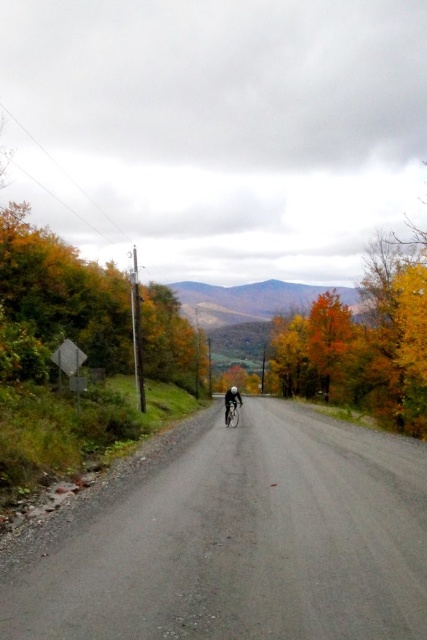
Is gray gravel road at center below shiny metallic bicycle at center?

No, gray gravel road at center is not below shiny metallic bicycle at center.

Who is more distant from viewer, (190, 460) or (236, 410)?

Positioned behind is point (236, 410).

Does point (351, 579) come closer to viewer compared to point (231, 420)?

Yes, it is.

Locate an element on the screen. This screenshot has width=427, height=640. gray gravel road at center is located at coordinates (233, 538).

Is gray gravel road at center thinner than yellow leafy tree at center?

Yes.

Can you confirm if gray gravel road at center is taller than yellow leafy tree at center?

No, gray gravel road at center is not taller than yellow leafy tree at center.

The height and width of the screenshot is (640, 427). What do you see at coordinates (233, 538) in the screenshot?
I see `gray gravel road at center` at bounding box center [233, 538].

Locate an element on the screen. gray gravel road at center is located at coordinates (233, 538).

Between yellow leafy tree at center and shiny metallic bicycle at center, which one appears on the right side from the viewer's perspective?

Positioned to the right is yellow leafy tree at center.

Who is higher up, yellow leafy tree at center or shiny metallic bicycle at center?

Positioned higher is yellow leafy tree at center.

The width and height of the screenshot is (427, 640). I want to click on yellow leafy tree at center, so click(x=365, y=340).